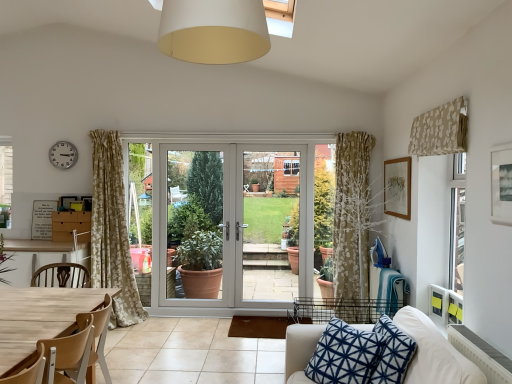
Question: From a real-world perspective, is white fabric couch at lower right physically above white plastic clock at upper left?

Choices:
 (A) yes
 (B) no

Answer: (B)

Question: Does white fabric couch at lower right contain white plastic clock at upper left?

Choices:
 (A) no
 (B) yes

Answer: (A)

Question: From a real-world perspective, is white fabric couch at lower right positioned under white plastic clock at upper left based on gravity?

Choices:
 (A) no
 (B) yes

Answer: (B)

Question: Is white fabric couch at lower right closer to camera compared to white plastic clock at upper left?

Choices:
 (A) yes
 (B) no

Answer: (A)

Question: Is white fabric couch at lower right facing away from white plastic clock at upper left?

Choices:
 (A) yes
 (B) no

Answer: (B)

Question: Can you confirm if white fabric couch at lower right is taller than white plastic clock at upper left?

Choices:
 (A) no
 (B) yes

Answer: (B)

Question: Does matte white screen door at center, arranged as the 3th screen door when viewed from the right, contain beige floral fabric at upper right?

Choices:
 (A) yes
 (B) no

Answer: (B)

Question: Does matte white screen door at center, which is the 1th screen door in left-to-right order, lie in front of beige floral fabric at upper right?

Choices:
 (A) no
 (B) yes

Answer: (A)

Question: Is matte white screen door at center, arranged as the 3th screen door when viewed from the right, not close to beige floral fabric at upper right?

Choices:
 (A) no
 (B) yes

Answer: (B)

Question: Is matte white screen door at center, which is the 1th screen door in left-to-right order, further to the viewer compared to beige floral fabric at upper right?

Choices:
 (A) no
 (B) yes

Answer: (B)

Question: Is matte white screen door at center, which is the 1th screen door in left-to-right order, smaller than beige floral fabric at upper right?

Choices:
 (A) no
 (B) yes

Answer: (A)

Question: Is matte white screen door at center, which is the 1th screen door in left-to-right order, at the right side of beige floral fabric at upper right?

Choices:
 (A) no
 (B) yes

Answer: (A)

Question: Is wooden picture frame at upper right, the 1th picture frame positioned from the right, far away from white glossy door at center, which appears as the 1th screen door when viewed from the right?

Choices:
 (A) no
 (B) yes

Answer: (B)